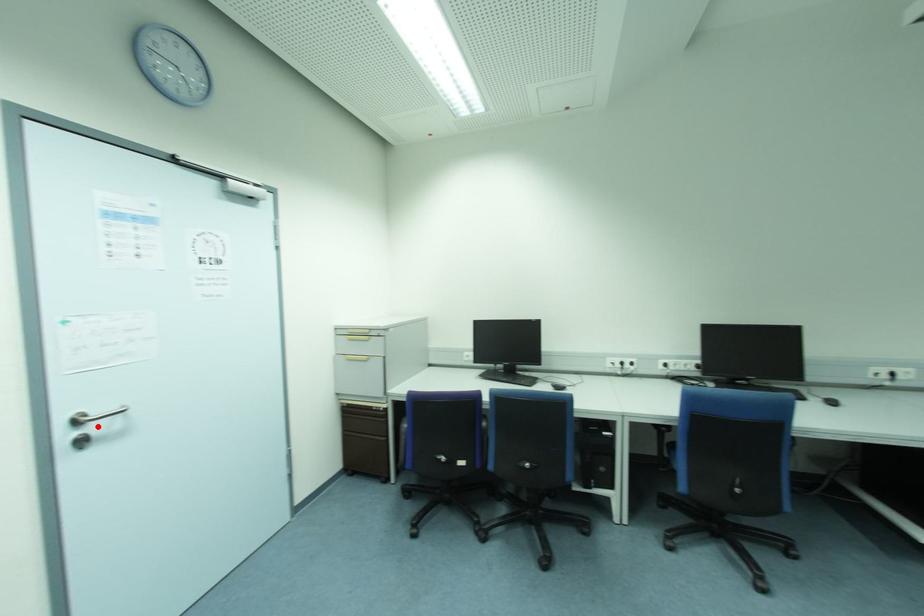
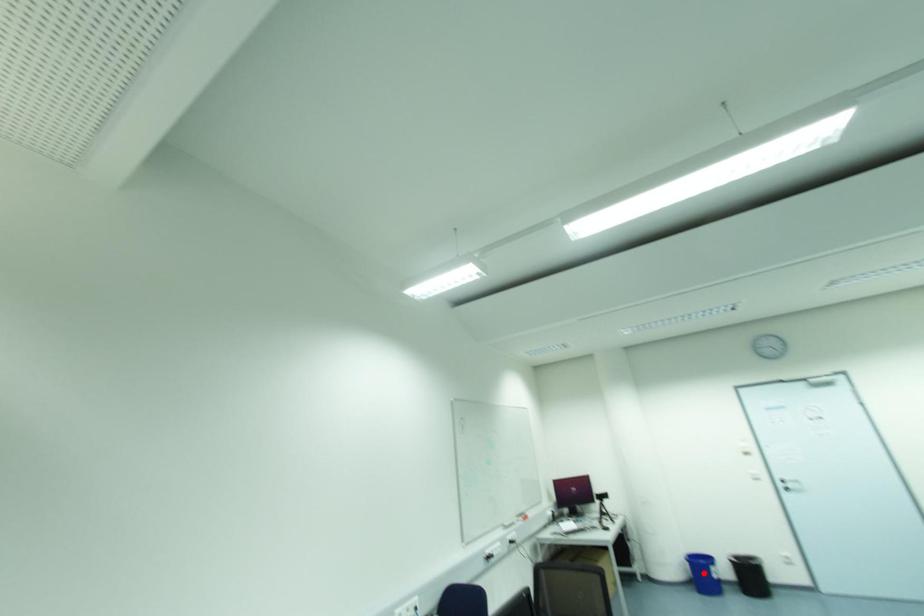
I am providing you with two images of the same scene from different viewpoints. A red point is marked on the first image and another point is marked on the second image. Is the red point in image1 aligned with the point shown in image2?

No